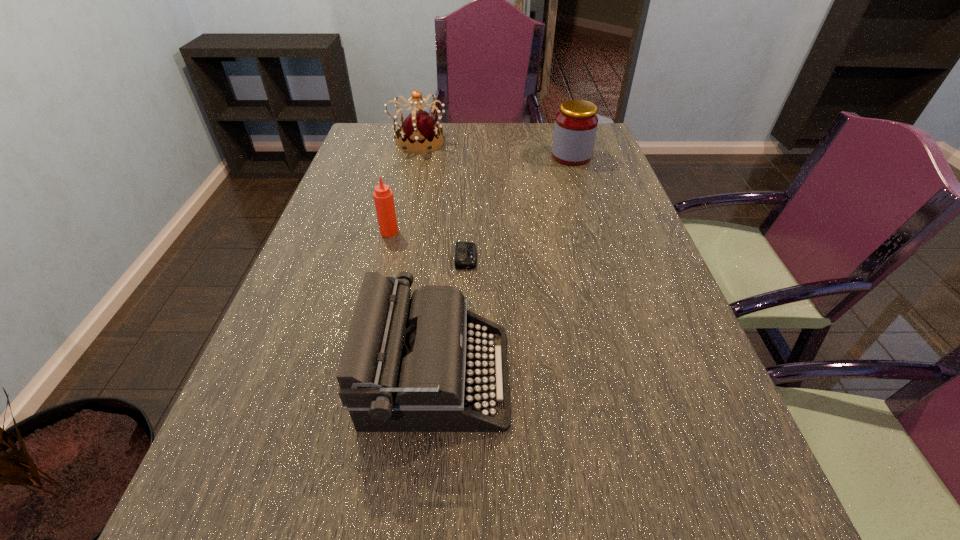
You are a GUI agent. You are given a task and a screenshot of the screen. Output one action in this format:
    pyautogui.click(x=<x>, y=<y>)
    Task: Click on the tiara
    The image size is (960, 540).
    Given the screenshot: What is the action you would take?
    pyautogui.click(x=419, y=131)

Locate an element on the screen. The image size is (960, 540). jar is located at coordinates (576, 123).

Find the location of a particular element. the third farthest object is located at coordinates (383, 197).

Find the location of a particular element. The image size is (960, 540). the nearest object is located at coordinates (402, 369).

Find the location of a particular element. The image size is (960, 540). the fourth farthest object is located at coordinates (465, 252).

Locate an element on the screen. Image resolution: width=960 pixels, height=540 pixels. the shortest object is located at coordinates (465, 252).

What are the coordinates of `free space located on the front-facing side of the tiara` in the screenshot? It's located at (538, 142).

At what (x,y) coordinates should I click in order to perform the action: click on free space located 0.110m on the front of the rightmost object. Please return your answer as a coordinate pair (x, y). The width and height of the screenshot is (960, 540). Looking at the image, I should click on (580, 185).

Identify the location of vacant region located 0.190m on the front of the third nearest object. (375, 288).

At what (x,y) coordinates should I click in order to perform the action: click on free space located 0.320m on the typing side of the typewriter. Please return your answer as a coordinate pair (x, y). Looking at the image, I should click on (676, 376).